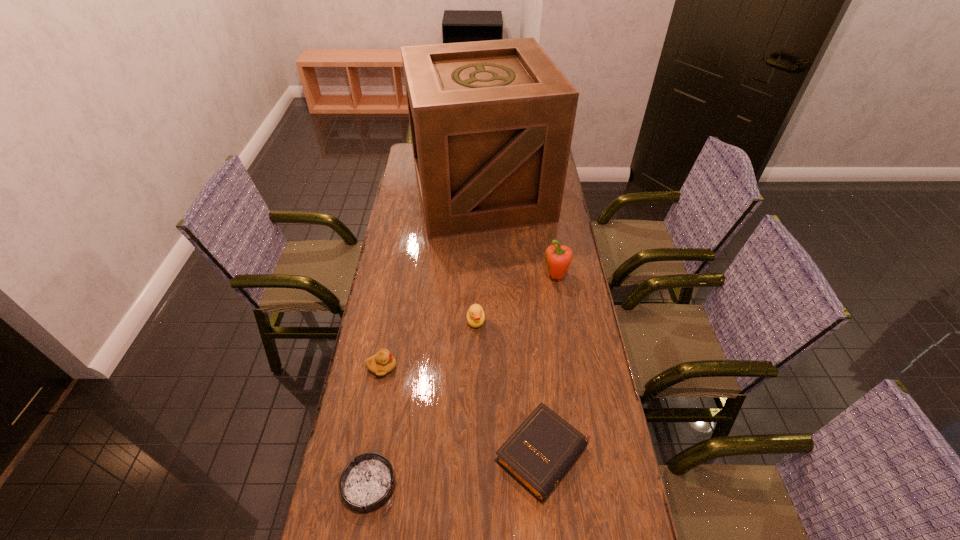
Where is `empty location between the fifth tallest object and the box`? The height and width of the screenshot is (540, 960). empty location between the fifth tallest object and the box is located at coordinates (513, 323).

Where is `vacant point located between the box and the third nearest object`? vacant point located between the box and the third nearest object is located at coordinates (432, 280).

Where is `free space between the fifth tallest object and the pepper`? free space between the fifth tallest object and the pepper is located at coordinates (550, 366).

Where is `vacant point located between the fifth nearest object and the shortest object`? Image resolution: width=960 pixels, height=540 pixels. vacant point located between the fifth nearest object and the shortest object is located at coordinates (463, 381).

The height and width of the screenshot is (540, 960). Find the location of `unoccupied position between the farther duckling and the second farthest object`. unoccupied position between the farther duckling and the second farthest object is located at coordinates (516, 299).

Identify which object is located as the fourth nearest to the second shortest object. Please provide its 2D coordinates. Your answer should be formatted as a tuple, i.e. [(x, y)], where the tuple contains the x and y coordinates of a point satisfying the conditions above.

[(558, 258)]

At what (x,y) coordinates should I click in order to perform the action: click on object that is the second closest one to the third nearest object. Please return your answer as a coordinate pair (x, y). Looking at the image, I should click on (367, 483).

Where is `free point that satisfies the following two spatial constraints: 1. on the face of the farther duckling; 2. on the left side of the Bible`? This screenshot has width=960, height=540. free point that satisfies the following two spatial constraints: 1. on the face of the farther duckling; 2. on the left side of the Bible is located at coordinates (474, 454).

Where is `free location that satisfies the following two spatial constraints: 1. at the beak of the second shortest object; 2. on the right side of the nearer duckling`? free location that satisfies the following two spatial constraints: 1. at the beak of the second shortest object; 2. on the right side of the nearer duckling is located at coordinates (367, 454).

Where is `free space that satisfies the following two spatial constraints: 1. on the front side of the box; 2. on the right side of the pepper`? free space that satisfies the following two spatial constraints: 1. on the front side of the box; 2. on the right side of the pepper is located at coordinates (482, 277).